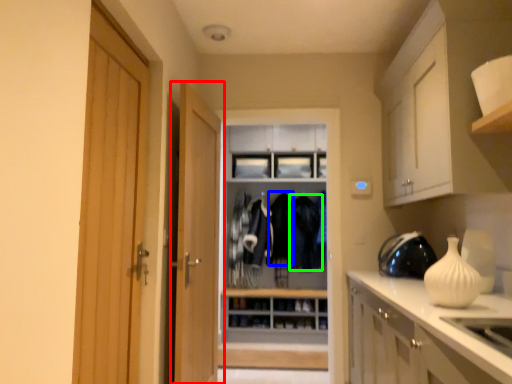
Question: Based on their relative distances, which object is farther from door (highlighted by a red box)? Choose from clothing (highlighted by a blue box) and clothing (highlighted by a green box).

Choices:
 (A) clothing
 (B) clothing

Answer: (B)